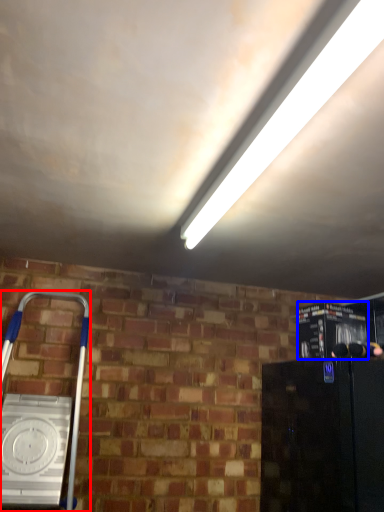
Question: Which of the following is the closest to the observer, home appliance (highlighted by a red box) or appliance (highlighted by a blue box)?

Choices:
 (A) home appliance
 (B) appliance

Answer: (A)